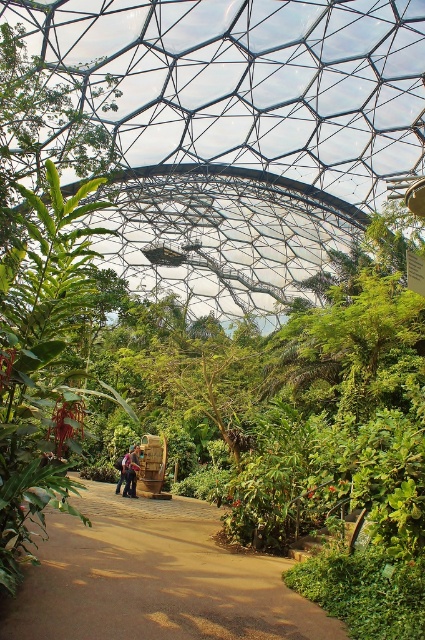
You are a visitor in the geodesic dome and want to walk from the entrance to the observation deck. You see the brown dirt path at center and the denim jacket at center. Which one is higher in elevation?

The brown dirt path at center is much taller than the denim jacket at center, so the path is higher in elevation.

You are standing in the geodesic dome and want to walk towards the brown dirt path at center. Which direction should you move relative to the dark blue jeans at center?

You should move to the right of the dark blue jeans at center to reach the brown dirt path at center.

You are a visitor exploring the geodesic dome conservatory. You notice a brown dirt path at center and a denim jacket at center. Which object is higher up in the dome structure?

The brown dirt path at center is above the denim jacket at center, so the brown dirt path at center is higher up in the dome structure.